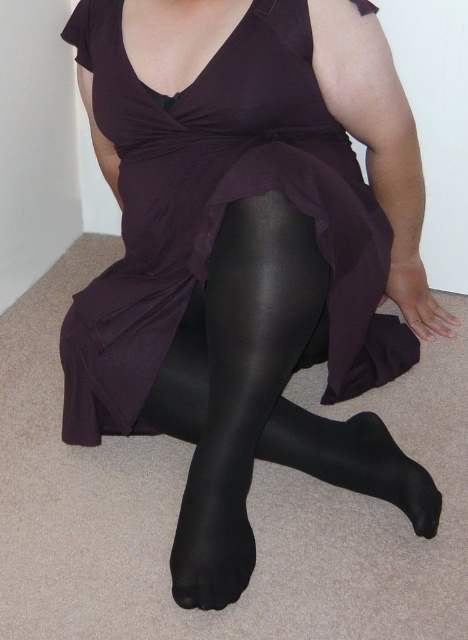
Consider the image. Between matte purple dress at center and black satin sock at lower center, which one has more height?

With more height is matte purple dress at center.

Can you confirm if matte purple dress at center is taller than black satin sock at lower center?

Yes, matte purple dress at center is taller than black satin sock at lower center.

Identify the location of matte purple dress at center. The width and height of the screenshot is (468, 640). (217, 208).

Can you confirm if matte purple dress at center is taller than shiny black tights at center?

Correct, matte purple dress at center is much taller as shiny black tights at center.

Is matte purple dress at center in front of shiny black tights at center?

Yes, it is.

Where is `matte purple dress at center`? Image resolution: width=468 pixels, height=640 pixels. matte purple dress at center is located at coordinates (217, 208).

Does shiny black tights at center come behind black satin sock at lower center?

That is False.

Can you confirm if shiny black tights at center is positioned below black satin sock at lower center?

No, shiny black tights at center is not below black satin sock at lower center.

Who is more distant from viewer, (228, 234) or (344, 461)?

Point (344, 461)

Find the location of a particular element. shiny black tights at center is located at coordinates (270, 403).